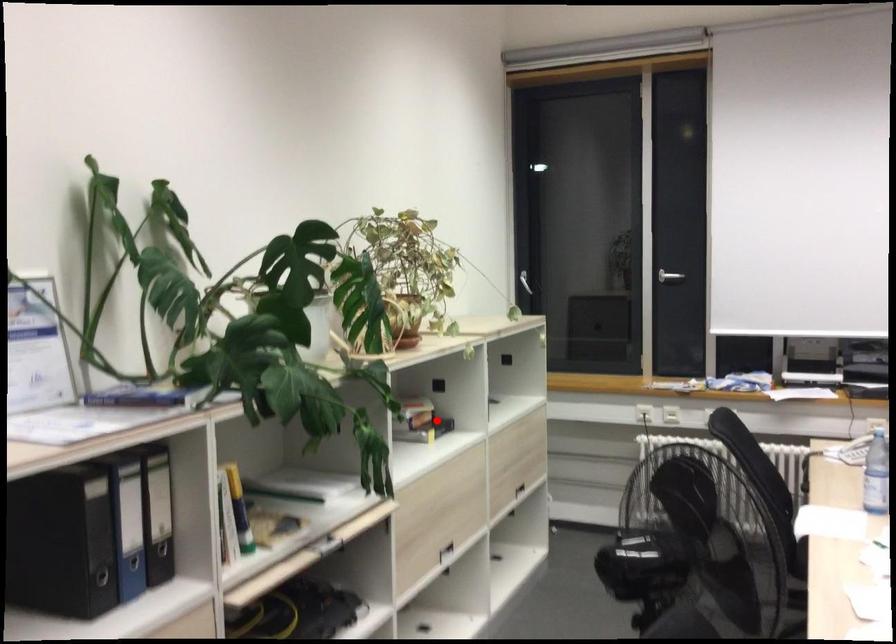
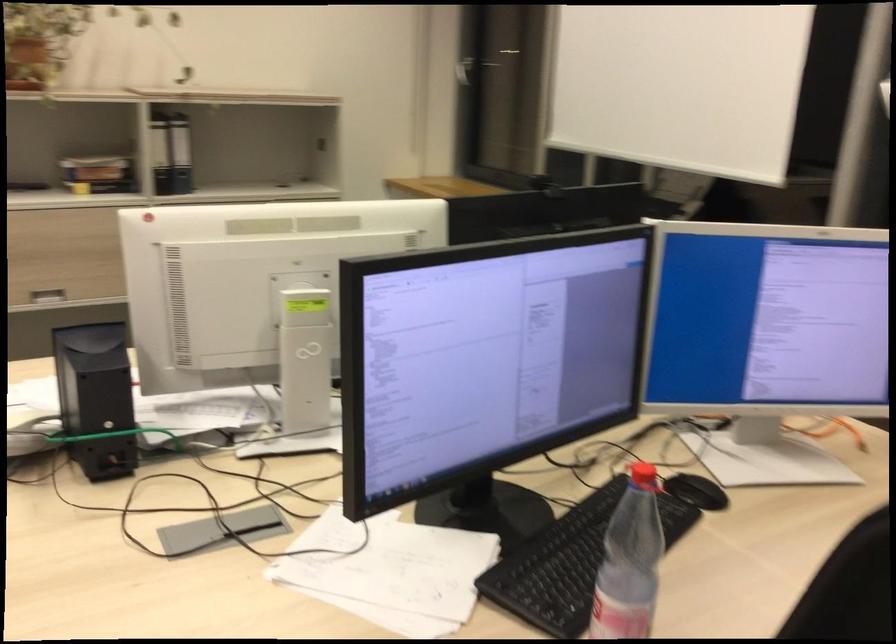
Find the pixel in the second image that matches the highlighted location in the first image.

(105, 175)